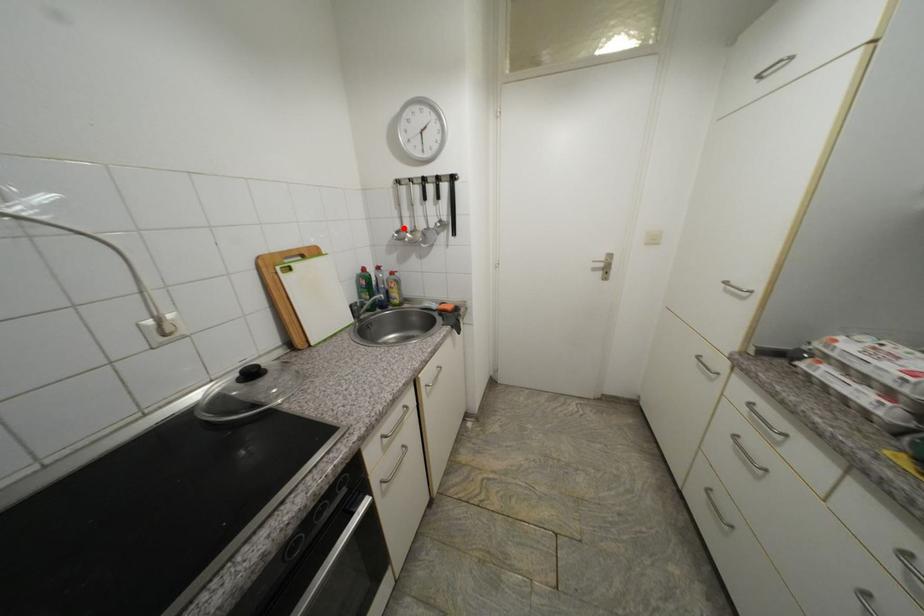
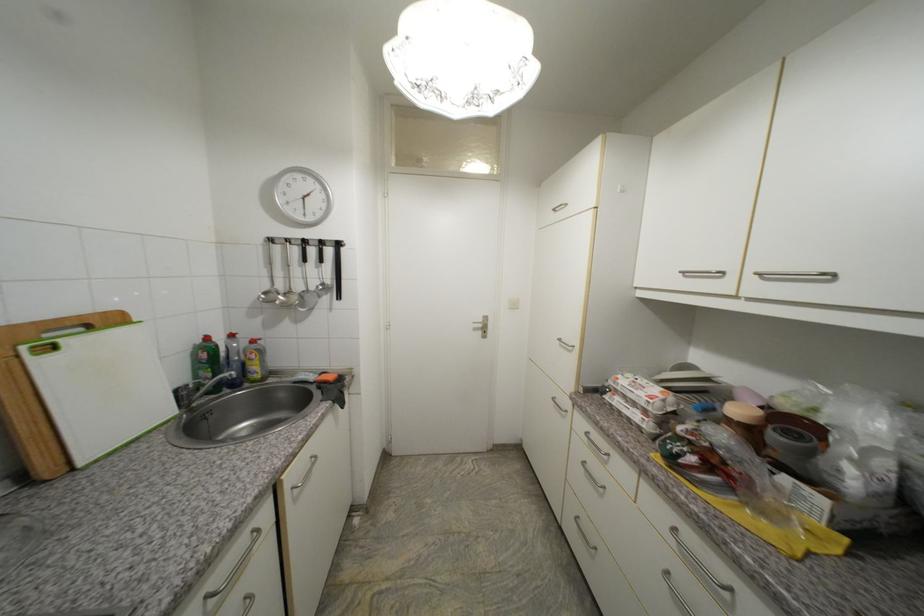
In the second image, find the point that corresponds to the highlighted location in the first image.

(273, 288)